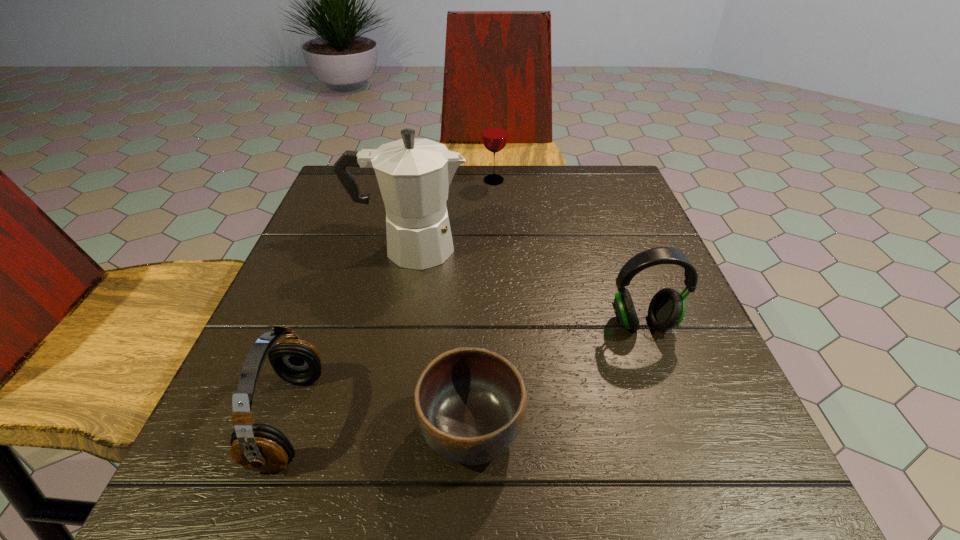
Find the location of a particular element. This screenshot has height=540, width=960. coffeepot is located at coordinates (414, 175).

Where is `the tallest object`? the tallest object is located at coordinates (414, 175).

Where is `glass`? The image size is (960, 540). glass is located at coordinates (494, 136).

You are a GUI agent. You are given a task and a screenshot of the screen. Output one action in this format:
    pyautogui.click(x=<x>, y=<y>)
    Task: Click on the right headset
    This screenshot has width=960, height=540.
    Given the screenshot: What is the action you would take?
    pyautogui.click(x=666, y=311)

The height and width of the screenshot is (540, 960). Identify the location of the farther headset. (666, 311).

What are the coordinates of `the left headset` in the screenshot? It's located at (258, 447).

This screenshot has height=540, width=960. Identify the location of bowl. (470, 403).

Image resolution: width=960 pixels, height=540 pixels. In order to click on vacant area located at the spout of the second farthest object in this screenshot , I will do `click(547, 248)`.

Identify the location of vacant area situated on the left of the farthest object. (383, 180).

Identify the location of free space located 0.050m on the ear cups of the rightmost object. The width and height of the screenshot is (960, 540). 657,363.